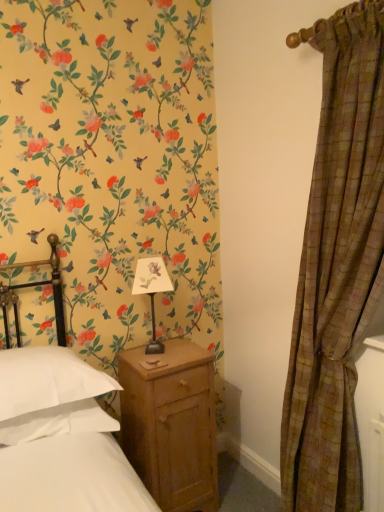
Locate an element on the screen. free spot above wooden nightstand at lower center (from a real-world perspective) is located at coordinates (158, 356).